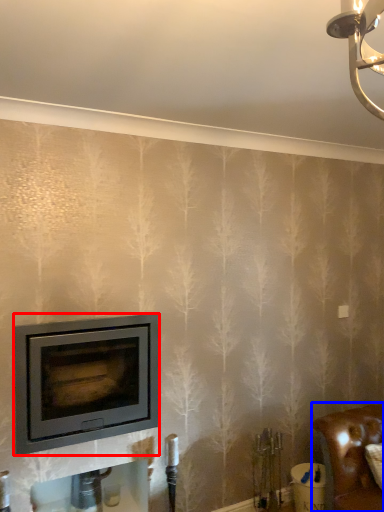
Question: Among these objects, which one is farthest to the camera, wood burning stove (highlighted by a red box) or furniture (highlighted by a blue box)?

Choices:
 (A) wood burning stove
 (B) furniture

Answer: (B)